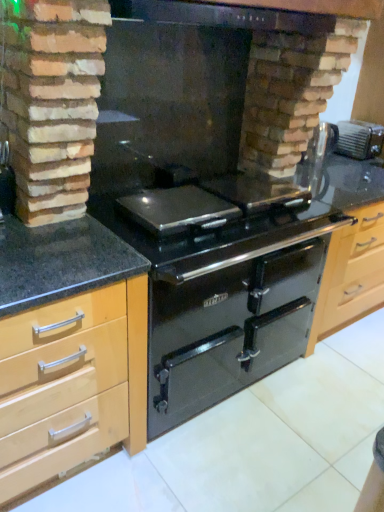
Question: Does black glass fireplace at center have a smaller size compared to black glass exhaust hood at upper center?

Choices:
 (A) no
 (B) yes

Answer: (A)

Question: Would you consider black glass fireplace at center to be distant from black glass exhaust hood at upper center?

Choices:
 (A) no
 (B) yes

Answer: (A)

Question: Is black glass fireplace at center outside of black glass exhaust hood at upper center?

Choices:
 (A) no
 (B) yes

Answer: (B)

Question: Is the position of black glass fireplace at center more distant than that of black glass exhaust hood at upper center?

Choices:
 (A) yes
 (B) no

Answer: (B)

Question: Does black glass fireplace at center have a lesser width compared to black glass exhaust hood at upper center?

Choices:
 (A) no
 (B) yes

Answer: (B)

Question: Considering the positions of metallic silver toaster at upper right and light wood/wooden cabinet at left in the image, is metallic silver toaster at upper right wider or thinner than light wood/wooden cabinet at left?

Choices:
 (A) thin
 (B) wide

Answer: (A)

Question: Does point (340, 147) appear closer or farther from the camera than point (36, 372)?

Choices:
 (A) closer
 (B) farther

Answer: (B)

Question: Would you say metallic silver toaster at upper right is inside or outside light wood/wooden cabinet at left?

Choices:
 (A) inside
 (B) outside

Answer: (B)

Question: Visually, is metallic silver toaster at upper right positioned to the left or to the right of light wood/wooden cabinet at left?

Choices:
 (A) left
 (B) right

Answer: (B)

Question: Considering their positions, is light wood/wooden cabinet at left located in front of or behind black glass exhaust hood at upper center?

Choices:
 (A) front
 (B) behind

Answer: (A)

Question: Based on their sizes in the image, would you say light wood/wooden cabinet at left is bigger or smaller than black glass exhaust hood at upper center?

Choices:
 (A) big
 (B) small

Answer: (A)

Question: From the image's perspective, is light wood/wooden cabinet at left located above or below black glass exhaust hood at upper center?

Choices:
 (A) below
 (B) above

Answer: (A)

Question: Which is correct: light wood/wooden cabinet at left is inside black glass exhaust hood at upper center, or outside of it?

Choices:
 (A) inside
 (B) outside

Answer: (B)

Question: Considering the positions of glossy black oven at center and light wood/wooden cabinet at left in the image, is glossy black oven at center taller or shorter than light wood/wooden cabinet at left?

Choices:
 (A) short
 (B) tall

Answer: (A)

Question: Relative to light wood/wooden cabinet at left, is glossy black oven at center in front or behind?

Choices:
 (A) front
 (B) behind

Answer: (B)